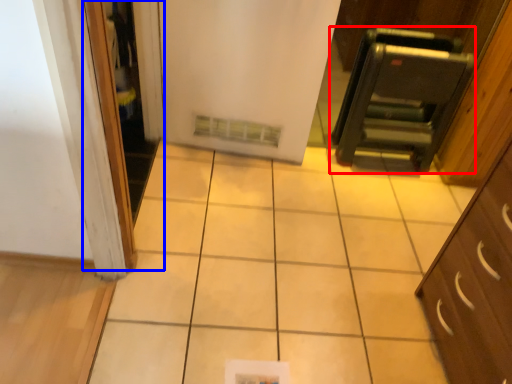
Question: Which point is further to the camera, appliance (highlighted by a red box) or screen door (highlighted by a blue box)?

Choices:
 (A) appliance
 (B) screen door

Answer: (A)